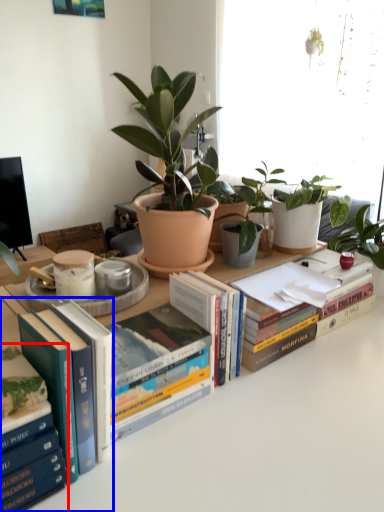
Question: Which object appears closest to the camera in this image, book (highlighted by a red box) or book (highlighted by a blue box)?

Choices:
 (A) book
 (B) book

Answer: (A)